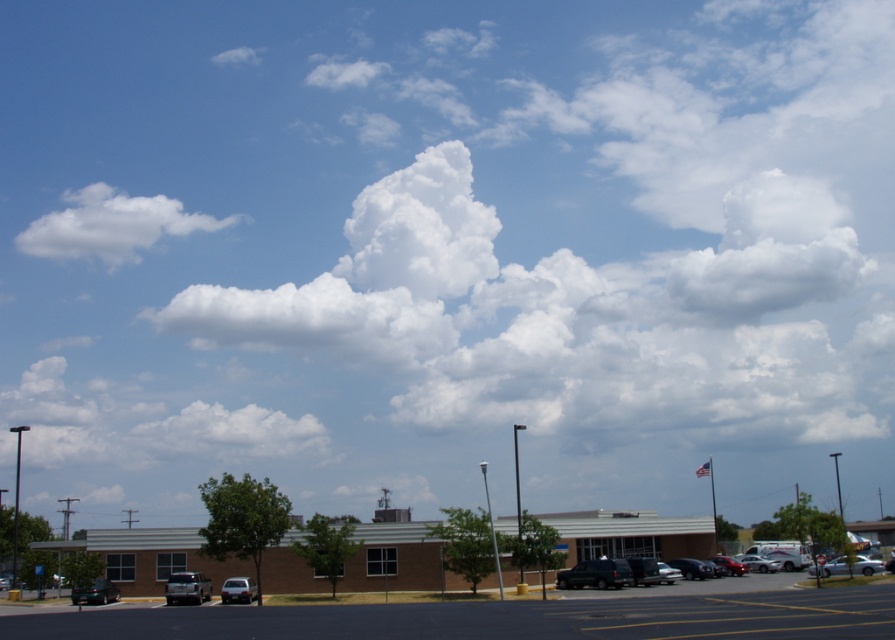
You are standing at the entrance of the building and want to reach your car, which is the shiny black sedan at lower left. There is a matte silver sedan at lower center blocking your path. Can you walk around it easily?

The shiny black sedan at lower left is closer to the viewer than the matte silver sedan at lower center, so you can easily walk around the matte silver sedan at lower center to reach your car.

You are a delivery driver who needs to park your shiny red car at lower right in the black asphalt parking lot at lower center. Can your car fit into the parking space?

The black asphalt parking lot at lower center is larger in size than the shiny red car at lower right, so yes, the car can fit into the parking space.

You are a parking attendant who needs to guide a driver to park their car. The driver wants to park their new car between the shiny black sedan at lower left and the matte silver sedan at lower center. Is there enough space between them for a standard car? Please explain your reasoning based on their positions.

The shiny black sedan at lower left is to the left of the matte silver sedan at lower center. Since the driver wants to park between them, but the shiny black sedan at lower left is already positioned to the left of the matte silver sedan at lower center, there is no space in between for another car. The two sedans are adjacent to each other.